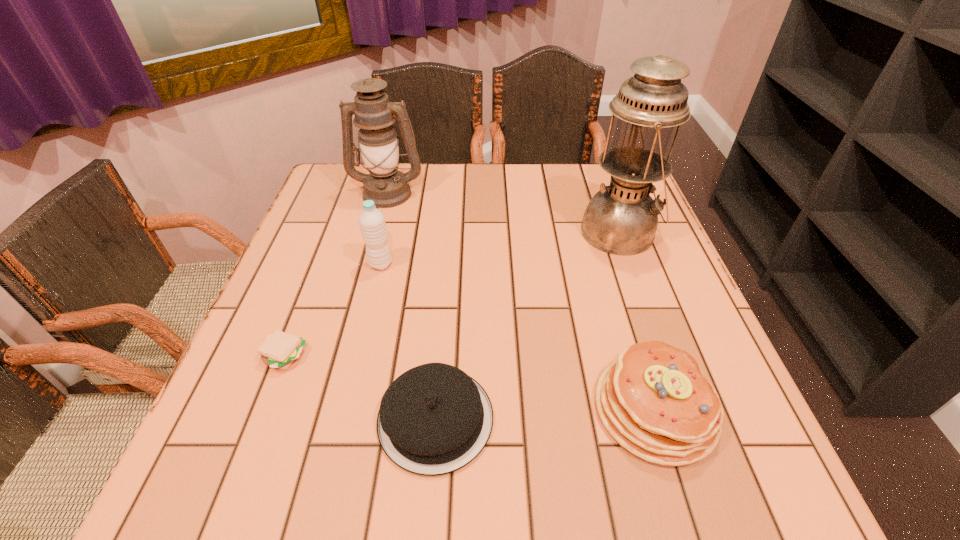
Where is `oil lamp at the right edge`? oil lamp at the right edge is located at coordinates (621, 219).

Identify the location of pancake located at the right edge. (654, 401).

You are a GUI agent. You are given a task and a screenshot of the screen. Output one action in this format:
    pyautogui.click(x=<x>, y=<y>)
    Task: Click on the object situated at the far left corner
    
    Given the screenshot: What is the action you would take?
    pyautogui.click(x=374, y=114)

Find the location of a particular element. Image resolution: width=960 pixels, height=540 pixels. object positioned at the near right corner is located at coordinates (654, 401).

Find the location of `blank area at the far edge`. blank area at the far edge is located at coordinates (466, 198).

The image size is (960, 540). In the image, there is a desktop. Identify the location of vacant area at the left edge. pyautogui.click(x=342, y=308).

This screenshot has width=960, height=540. Find the location of `vacant space at the right edge`. vacant space at the right edge is located at coordinates (724, 436).

This screenshot has width=960, height=540. I want to click on vacant space at the far left corner of the desktop, so click(x=324, y=187).

I want to click on free space at the far right corner of the desktop, so click(588, 169).

Where is `vacant area between the right pancake and the water bottle`? The width and height of the screenshot is (960, 540). vacant area between the right pancake and the water bottle is located at coordinates click(517, 337).